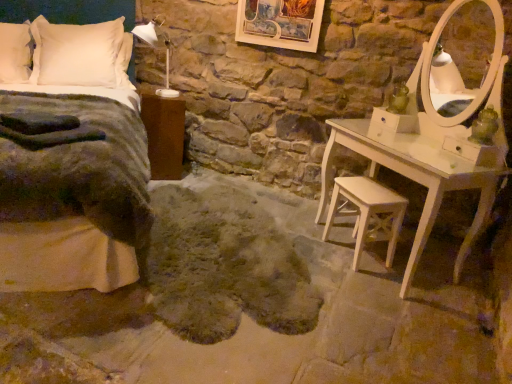
The image size is (512, 384). In order to click on vacant region under white wood stool at lower right (from a real-world perspective) in this screenshot , I will do `click(349, 257)`.